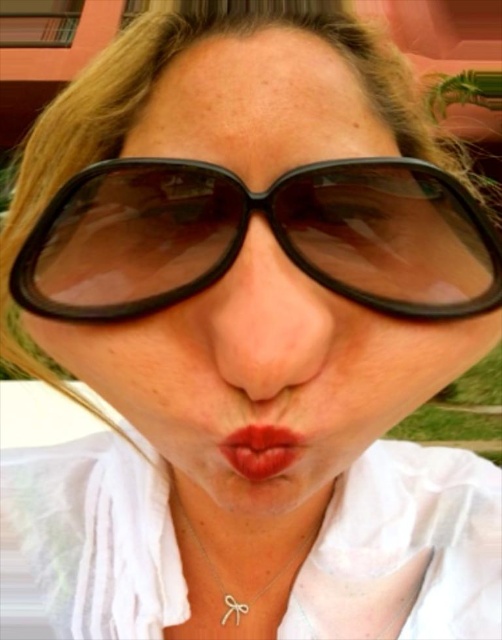
You are a photographer trying to capture the silver metallic bow at center and the shiny red lips at center in a close shot. Which object should you focus on first if you want to ensure both are in clear view, considering their sizes?

The silver metallic bow at center is larger than the shiny red lips at center, so focusing on the silver metallic bow at center first will help ensure both are in clear view as it requires more attention due to its size.

You are a photographer adjusting your camera settings to capture the perfect shot of the silver metallic bow at center. The camera has a minimum focusing distance of 18 inches. Will you need to move closer or farther away to ensure the bow is in focus?

The silver metallic bow at center is currently 16.54 inches away from the camera, which is closer than the minimum focusing distance of 18 inches. Therefore, you need to move farther away from the bow to ensure it is in focus.

You are taking a photo of the person in the image. You want to focus on the point closer to you. Which point should you choose between point [273,256] and point [257,476]?

Point [273,256] is further to the camera than point [257,476], so you should choose point [273,256] to focus on the point closer to you.